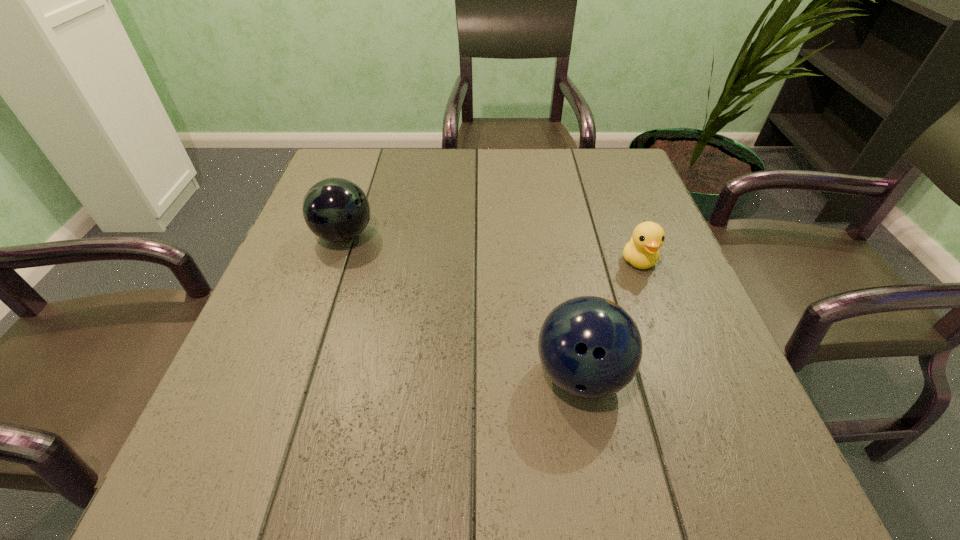
What are the coordinates of `vacant space that is in between the duck and the leftmost object` in the screenshot? It's located at (492, 248).

The width and height of the screenshot is (960, 540). I want to click on object that is the closest to the shortest object, so click(590, 347).

At what (x,y) coordinates should I click in order to perform the action: click on object that is the closest to the nearest object. Please return your answer as a coordinate pair (x, y). The image size is (960, 540). Looking at the image, I should click on (641, 251).